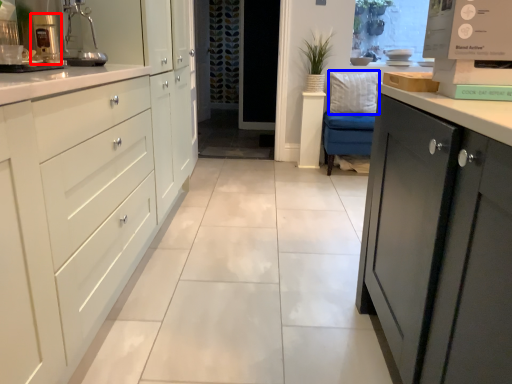
Question: Which point is closer to the camera, coffee machine (highlighted by a red box) or pillow (highlighted by a blue box)?

Choices:
 (A) coffee machine
 (B) pillow

Answer: (A)